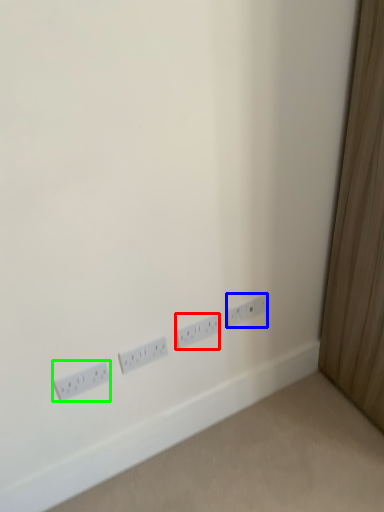
Question: Considering the real-world distances, which object is farthest from power plugs and sockets (highlighted by a red box)? power plugs and sockets (highlighted by a blue box) or power plugs and sockets (highlighted by a green box)?

Choices:
 (A) power plugs and sockets
 (B) power plugs and sockets

Answer: (B)